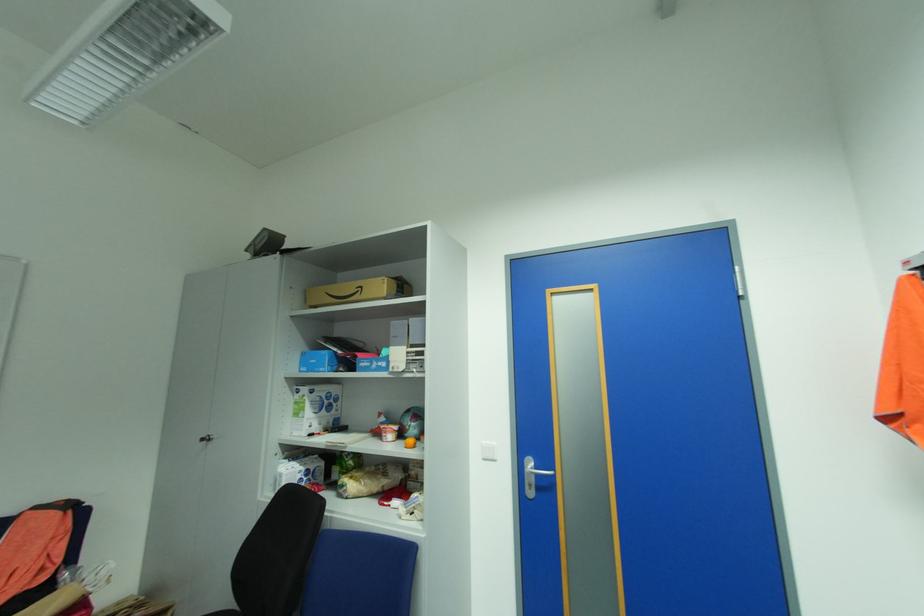
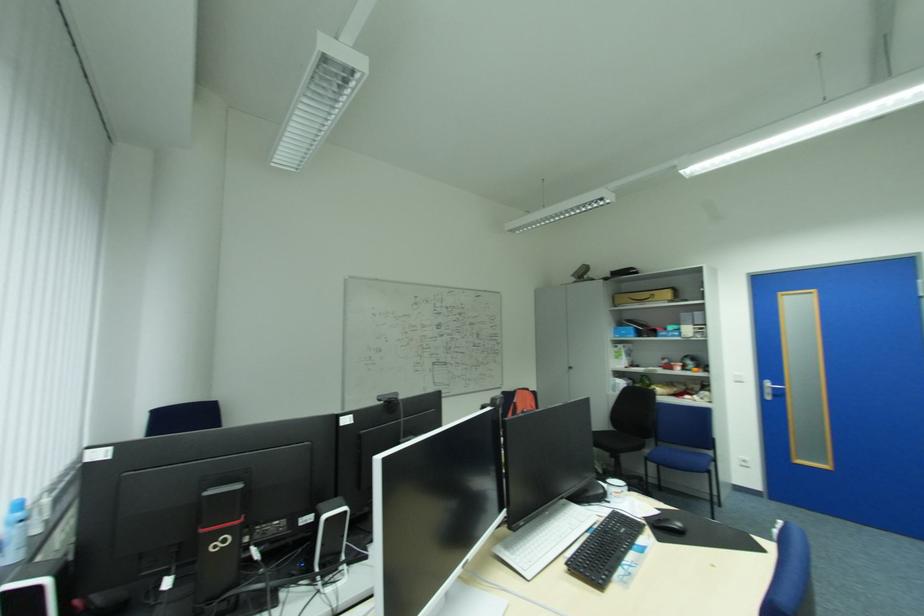
Find the pixel in the second image that matches the point at 368,286 in the first image.

(659, 294)